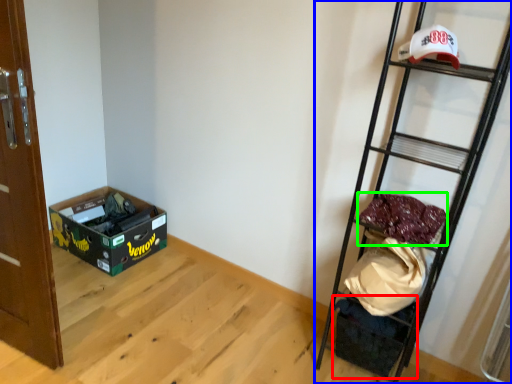
Question: Considering the real-world distances, which object is closest to storage box (highlighted by a red box)? ladder (highlighted by a blue box) or material (highlighted by a green box).

Choices:
 (A) ladder
 (B) material

Answer: (A)